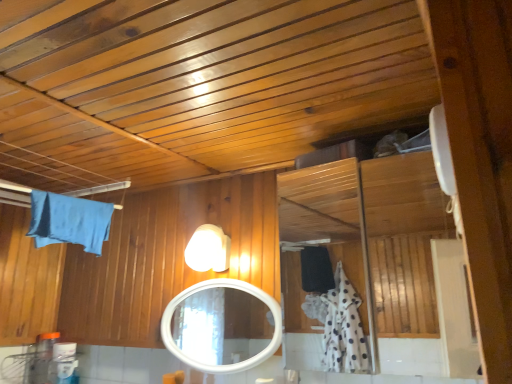
Question: From the image's perspective, does blue fabric bath towel at upper left appear higher than white glossy light fixture at upper center?

Choices:
 (A) no
 (B) yes

Answer: (B)

Question: Can you confirm if blue fabric bath towel at upper left is wider than white glossy light fixture at upper center?

Choices:
 (A) yes
 (B) no

Answer: (B)

Question: Is blue fabric bath towel at upper left closer to the viewer compared to white glossy light fixture at upper center?

Choices:
 (A) yes
 (B) no

Answer: (A)

Question: From the image's perspective, is blue fabric bath towel at upper left beneath white glossy light fixture at upper center?

Choices:
 (A) no
 (B) yes

Answer: (A)

Question: Is blue fabric bath towel at upper left taller than white glossy light fixture at upper center?

Choices:
 (A) no
 (B) yes

Answer: (B)

Question: From the image's perspective, is white glossy mirror at center above or below blue fabric bath towel at upper left?

Choices:
 (A) above
 (B) below

Answer: (B)

Question: Considering the positions of white glossy mirror at center and blue fabric bath towel at upper left in the image, is white glossy mirror at center taller or shorter than blue fabric bath towel at upper left?

Choices:
 (A) short
 (B) tall

Answer: (B)

Question: Considering the positions of point (196, 322) and point (36, 225), is point (196, 322) closer or farther from the camera than point (36, 225)?

Choices:
 (A) closer
 (B) farther

Answer: (B)

Question: In the image, is white glossy mirror at center positioned in front of or behind blue fabric bath towel at upper left?

Choices:
 (A) behind
 (B) front

Answer: (A)

Question: Is point (98, 152) positioned closer to the camera than point (203, 251)?

Choices:
 (A) closer
 (B) farther

Answer: (A)

Question: From the image's perspective, is white glossy exhaust hood at upper right positioned above or below white glossy light fixture at upper center?

Choices:
 (A) above
 (B) below

Answer: (A)

Question: Is white glossy exhaust hood at upper right to the left or to the right of white glossy light fixture at upper center in the image?

Choices:
 (A) left
 (B) right

Answer: (A)

Question: Relative to white glossy light fixture at upper center, is white glossy exhaust hood at upper right in front or behind?

Choices:
 (A) front
 (B) behind

Answer: (A)

Question: From the image's perspective, relative to white glossy exhaust hood at upper right, is blue fabric bath towel at upper left above or below?

Choices:
 (A) below
 (B) above

Answer: (A)

Question: From a real-world perspective, relative to white glossy exhaust hood at upper right, is blue fabric bath towel at upper left vertically above or below?

Choices:
 (A) above
 (B) below

Answer: (B)